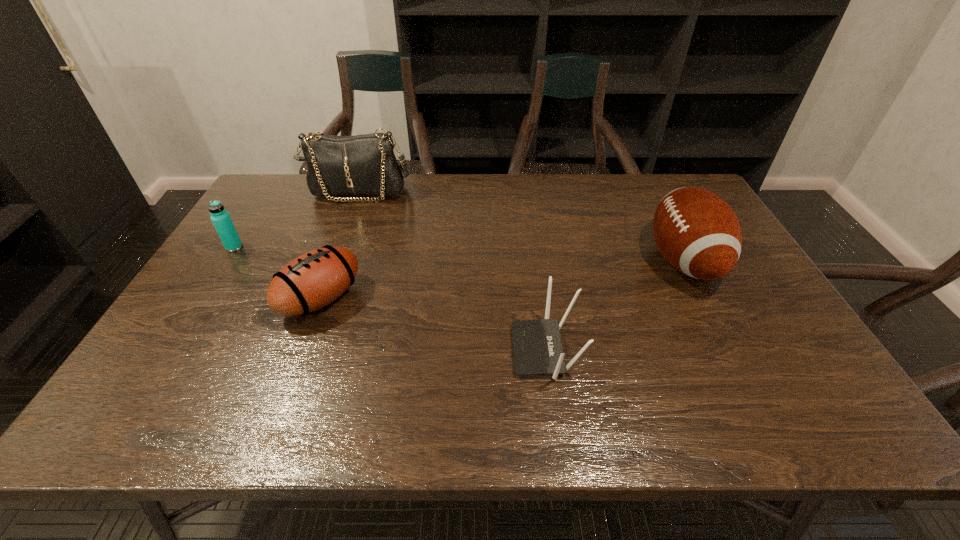
Where is `object present at the far left corner`? object present at the far left corner is located at coordinates (362, 165).

In the image, there is a desktop. Identify the location of vacant space at the far edge. The width and height of the screenshot is (960, 540). (421, 176).

This screenshot has width=960, height=540. I want to click on vacant space at the near edge of the desktop, so click(x=354, y=423).

Find the location of `vacant position at the left edge of the desktop`. vacant position at the left edge of the desktop is located at coordinates (230, 262).

Locate an element on the screen. vacant region at the near left corner is located at coordinates (174, 402).

This screenshot has height=540, width=960. In the image, there is a desktop. In order to click on free space at the near right corner in this screenshot , I will do `click(767, 394)`.

Locate an element on the screen. This screenshot has height=540, width=960. unoccupied position between the third tallest object and the handbag is located at coordinates (297, 220).

The image size is (960, 540). I want to click on free space between the third shortest object and the handbag, so (x=297, y=220).

Locate an element on the screen. This screenshot has height=540, width=960. empty location between the shorter football (American) and the router is located at coordinates (433, 325).

The width and height of the screenshot is (960, 540). Find the location of `vacant space that's between the leftmost object and the router`. vacant space that's between the leftmost object and the router is located at coordinates [x=390, y=299].